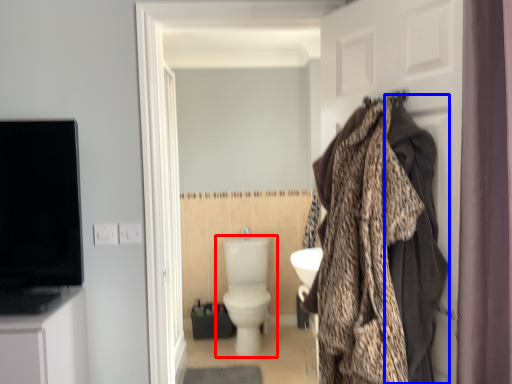
Question: Which point is closer to the camera, toilet (highlighted by a red box) or blanket (highlighted by a blue box)?

Choices:
 (A) toilet
 (B) blanket

Answer: (B)